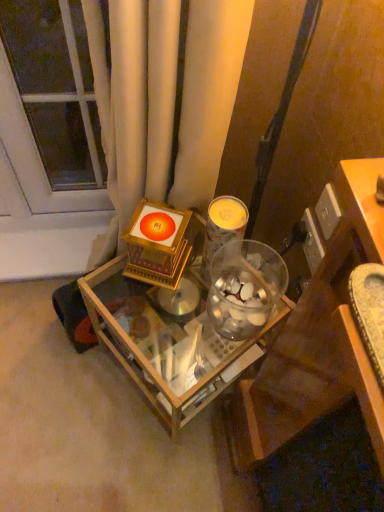
Question: Does transparent glass door at upper left contain metallic silver candle at center?

Choices:
 (A) no
 (B) yes

Answer: (A)

Question: Considering the relative positions of transparent glass door at upper left and metallic silver candle at center in the image provided, is transparent glass door at upper left in front of metallic silver candle at center?

Choices:
 (A) no
 (B) yes

Answer: (A)

Question: Is transparent glass door at upper left taller than metallic silver candle at center?

Choices:
 (A) no
 (B) yes

Answer: (B)

Question: Are transparent glass door at upper left and metallic silver candle at center located far from each other?

Choices:
 (A) yes
 (B) no

Answer: (B)

Question: From a real-world perspective, is transparent glass door at upper left located higher than metallic silver candle at center?

Choices:
 (A) yes
 (B) no

Answer: (B)

Question: Does point (206, 266) appear closer or farther from the camera than point (110, 281)?

Choices:
 (A) closer
 (B) farther

Answer: (A)

Question: From the image's perspective, relative to wooden table at center, is metallic silver candle at center above or below?

Choices:
 (A) above
 (B) below

Answer: (A)

Question: Considering their positions, is metallic silver candle at center located in front of or behind wooden table at center?

Choices:
 (A) front
 (B) behind

Answer: (A)

Question: From a real-world perspective, is metallic silver candle at center above or below wooden table at center?

Choices:
 (A) below
 (B) above

Answer: (B)

Question: Based on their sizes in the image, would you say transparent glass door at upper left is bigger or smaller than wooden table at center?

Choices:
 (A) small
 (B) big

Answer: (A)

Question: Looking at their shapes, would you say transparent glass door at upper left is wider or thinner than wooden table at center?

Choices:
 (A) wide
 (B) thin

Answer: (B)

Question: Considering their positions, is transparent glass door at upper left located in front of or behind wooden table at center?

Choices:
 (A) front
 (B) behind

Answer: (B)

Question: Is transparent glass door at upper left spatially inside wooden table at center, or outside of it?

Choices:
 (A) inside
 (B) outside

Answer: (B)

Question: From a real-world perspective, is metallic silver candle at center physically located above or below transparent glass door at upper left?

Choices:
 (A) above
 (B) below

Answer: (A)

Question: Choose the correct answer: Is metallic silver candle at center inside transparent glass door at upper left or outside it?

Choices:
 (A) inside
 (B) outside

Answer: (B)